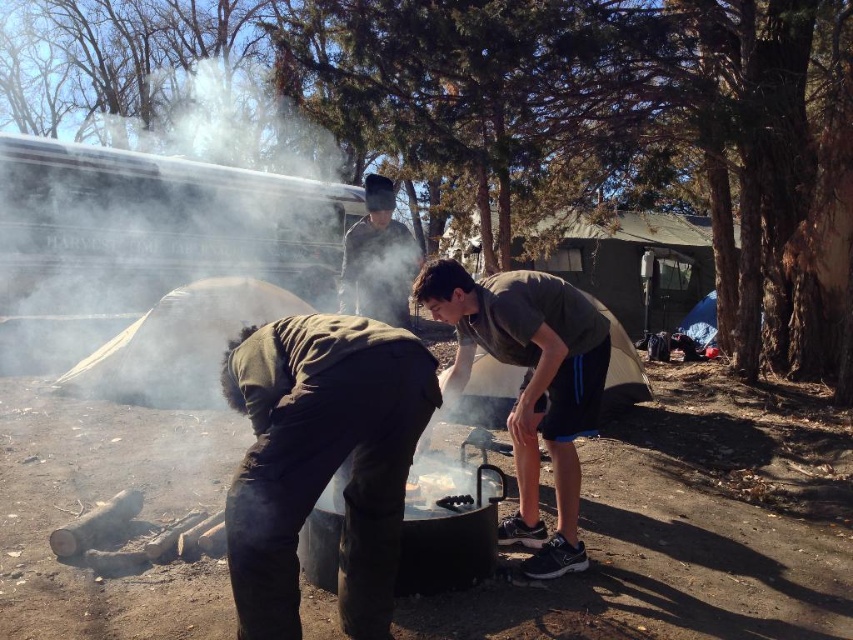
You are a camper who wants to know which item is closer to the ground between the dark gray knit hat at center and the green fabric tent at center. Based on the scene description, can you determine which one is closer to the ground?

The dark gray knit hat at center is shorter than the green fabric tent at center, so the dark gray knit hat at center is closer to the ground.

You are standing at the point with coordinates (531, 387) in the image. What is the color of the fabric you are standing on?

The point at (531, 387) is on dark gray fabric shirt at center, so the color is dark gray.

You are standing at the center of the campsite and want to hand a marshmallow to the person wearing the dark gray fabric shirt at center. In which direction should you move to reach them?

The dark gray fabric shirt at center is located at point (x=531, y=387), so you should move towards the center of the campsite to reach them.